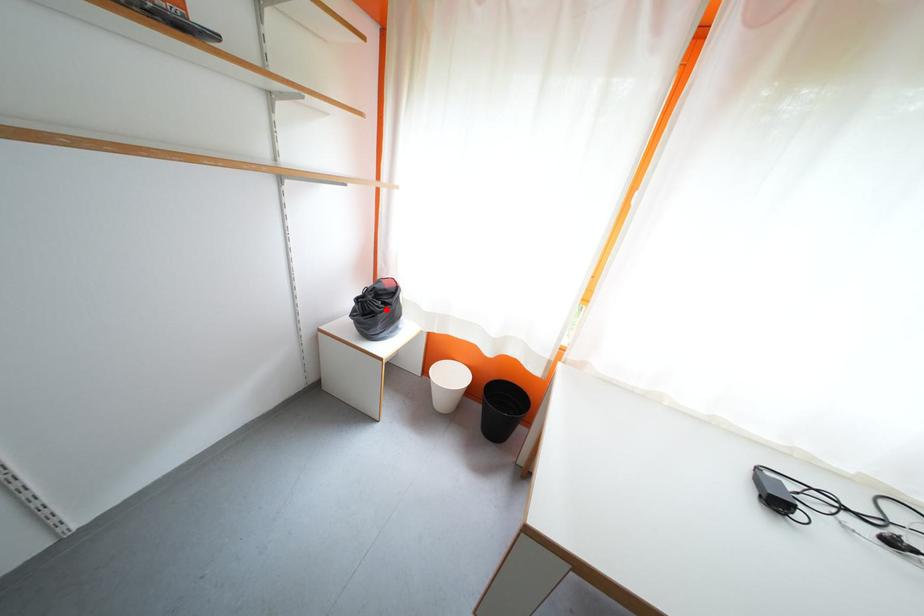
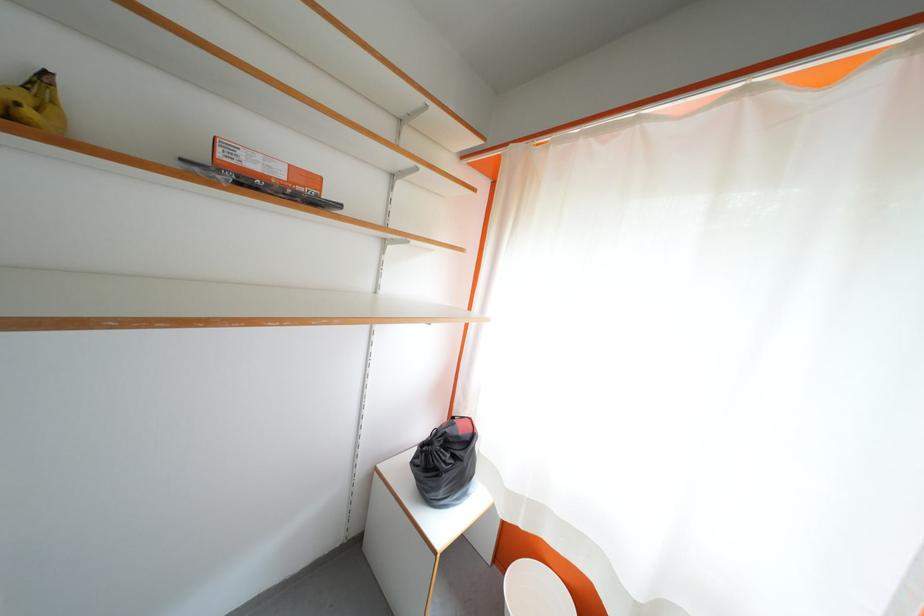
Where in the second image is the point corresponding to the highlighted location from the first image?

(455, 460)